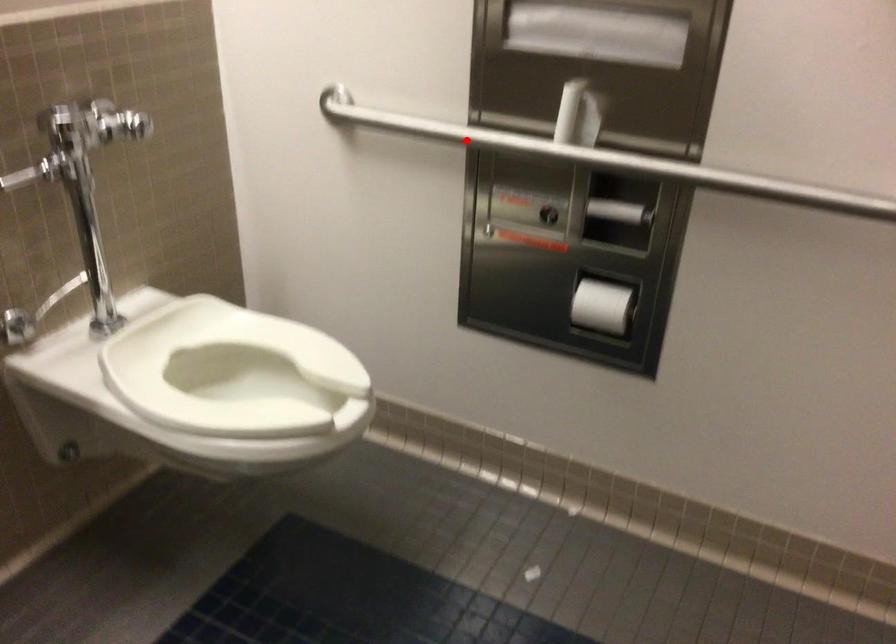
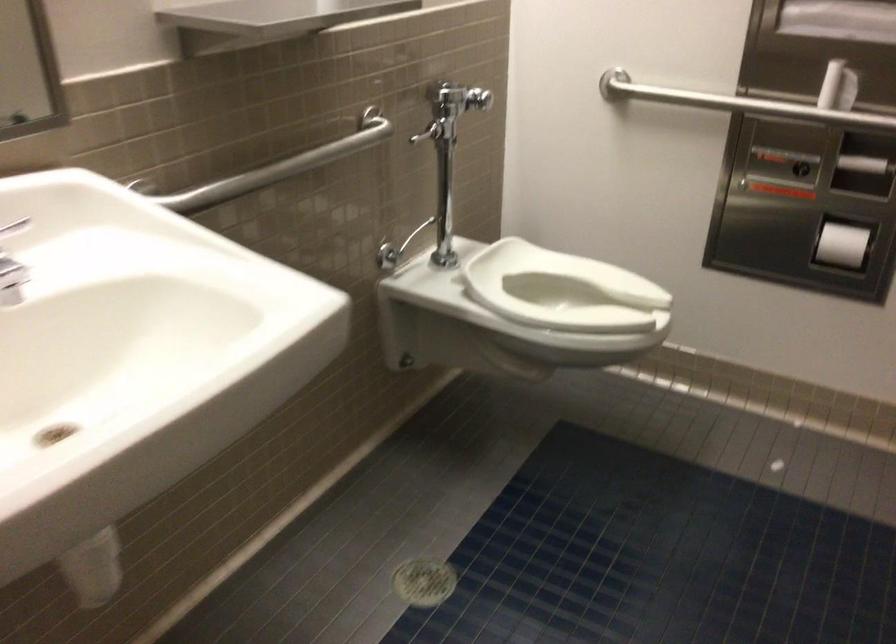
Question: I am providing you with two images of the same scene from different viewpoints. Image1 has a red point marked. In image2, the corresponding 3D location appears at what relative position? Reply with the corresponding letter.

Choices:
 (A) Closer
 (B) Farther

Answer: (B)